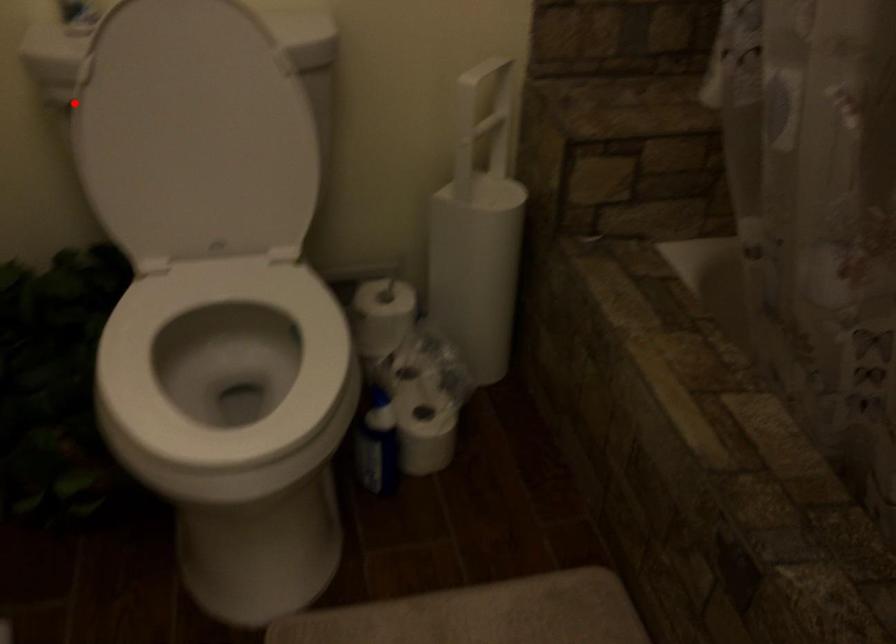
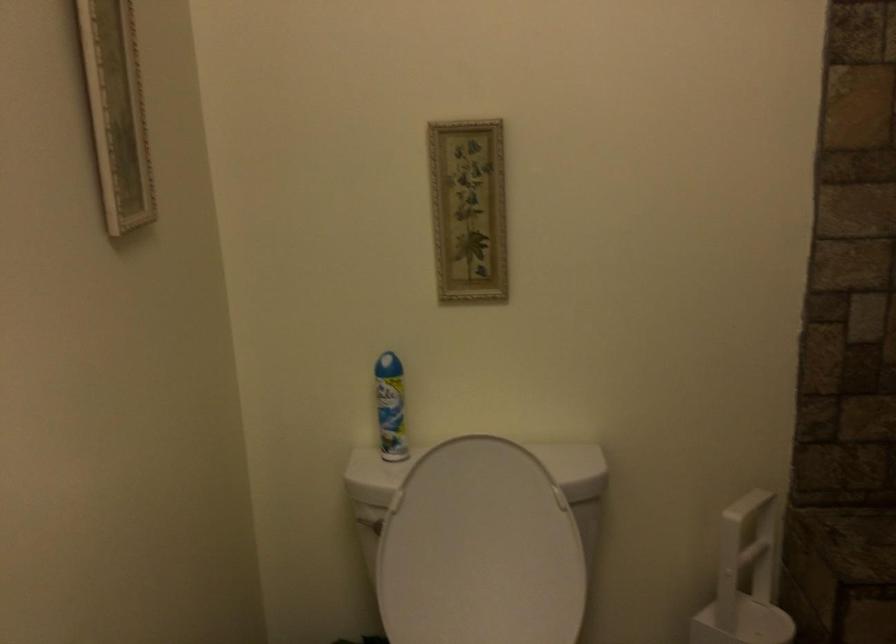
Question: I am providing you with two images of the same scene from different viewpoints. A red point is shown in image1. For the corresponding object point in image2, is it positioned nearer or farther from the camera?

Choices:
 (A) Nearer
 (B) Farther

Answer: (B)